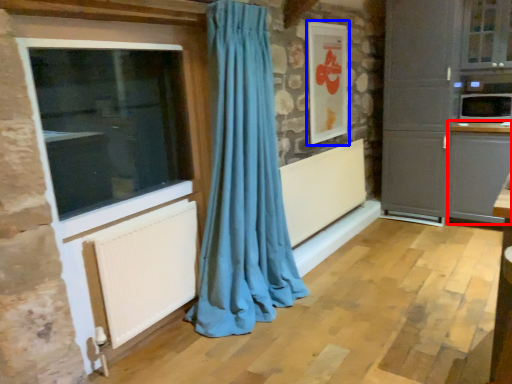
Question: Which of the following is the farthest to the observer, cabinetry (highlighted by a red box) or picture frame (highlighted by a blue box)?

Choices:
 (A) cabinetry
 (B) picture frame

Answer: (A)